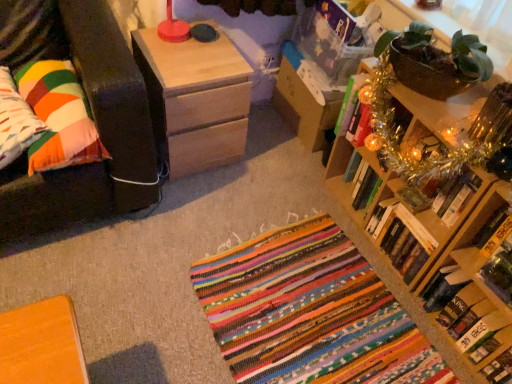
Question: Considering the relative positions of multicolored fabric pillow at left, the 1th pillow when ordered from left to right, and hardcover book at lower right, arranged as the second book when ordered from the bottom, in the image provided, is multicolored fabric pillow at left, the 1th pillow when ordered from left to right, in front of hardcover book at lower right, arranged as the second book when ordered from the bottom,?

Choices:
 (A) no
 (B) yes

Answer: (A)

Question: From a real-world perspective, is multicolored fabric pillow at left, the 1th pillow when ordered from left to right, physically below hardcover book at lower right, marked as the fourth book in a top-to-bottom arrangement?

Choices:
 (A) no
 (B) yes

Answer: (A)

Question: Can hardcover book at lower right, marked as the fourth book in a top-to-bottom arrangement, be found inside multicolored fabric pillow at left, marked as the 2th pillow in a right-to-left arrangement?

Choices:
 (A) no
 (B) yes

Answer: (A)

Question: Is multicolored fabric pillow at left, marked as the 2th pillow in a right-to-left arrangement, thinner than hardcover book at lower right, marked as the fourth book in a top-to-bottom arrangement?

Choices:
 (A) yes
 (B) no

Answer: (B)

Question: Is multicolored fabric pillow at left, marked as the 2th pillow in a right-to-left arrangement, oriented away from hardcover book at lower right, arranged as the second book when ordered from the bottom?

Choices:
 (A) no
 (B) yes

Answer: (A)

Question: From the image's perspective, relative to natural wood nightstand at upper left, is hardcover book at upper right, the fifth book positioned from the bottom, above or below?

Choices:
 (A) below
 (B) above

Answer: (A)

Question: Does point (344, 97) appear closer or farther from the camera than point (222, 112)?

Choices:
 (A) farther
 (B) closer

Answer: (B)

Question: From a real-world perspective, is hardcover book at upper right, marked as the first book in a top-to-bottom arrangement, physically located above or below natural wood nightstand at upper left?

Choices:
 (A) below
 (B) above

Answer: (B)

Question: Considering the positions of hardcover book at upper right, marked as the first book in a top-to-bottom arrangement, and natural wood nightstand at upper left in the image, is hardcover book at upper right, marked as the first book in a top-to-bottom arrangement, bigger or smaller than natural wood nightstand at upper left?

Choices:
 (A) small
 (B) big

Answer: (A)

Question: From a real-world perspective, is multicolored fabric pillow at left, the 1th pillow when ordered from left to right, positioned above or below metallic gold book at upper right, the 4th book positioned from the bottom?

Choices:
 (A) below
 (B) above

Answer: (B)

Question: Is multicolored fabric pillow at left, marked as the 2th pillow in a right-to-left arrangement, in front of or behind metallic gold book at upper right, which is the second book from top to bottom, in the image?

Choices:
 (A) behind
 (B) front

Answer: (B)

Question: Is point (17, 104) closer or farther from the camera than point (437, 195)?

Choices:
 (A) farther
 (B) closer

Answer: (B)

Question: Is multicolored fabric pillow at left, the 1th pillow when ordered from left to right, inside or outside of metallic gold book at upper right, the 4th book positioned from the bottom?

Choices:
 (A) inside
 (B) outside

Answer: (B)

Question: Is metallic gold book at upper right, which is the second book from top to bottom, wider or thinner than natural wood nightstand at upper left?

Choices:
 (A) thin
 (B) wide

Answer: (A)

Question: In terms of size, does metallic gold book at upper right, which is the second book from top to bottom, appear bigger or smaller than natural wood nightstand at upper left?

Choices:
 (A) small
 (B) big

Answer: (A)